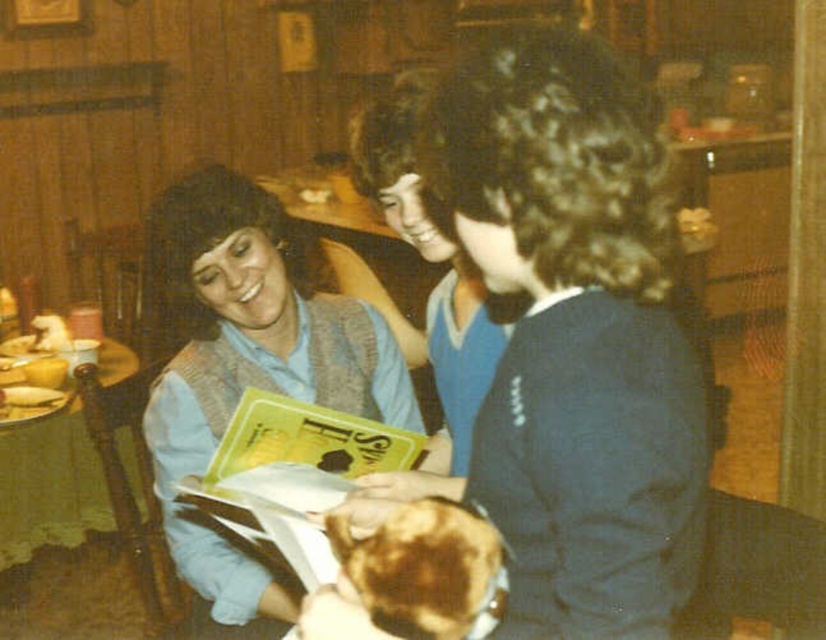
You are a server at a restaurant and need to deliver a drink to the table. The drink must be placed between the yellow paper book at center and the brown crispy bread at lower center. Is there enough space to place the drink there?

The yellow paper book at center and brown crispy bread at lower center are 8.17 inches apart from each other, so there is enough space to place the drink between them since 8.17 inches is more than the typical 4 inch width of a drink glass.

You are at a cozy dining table with two blue sweaters. The dark blue sweater at center and the matte blue sweater at center. Which one is positioned to the right of the other?

The dark blue sweater at center is to the right of the matte blue sweater at center.

You are standing in the dining area and see two points on the table. Which point is closer to you, point (292, 356) or point (366, 419)?

Point (292, 356) is closer to you because it is further to the viewer than point (366, 419).